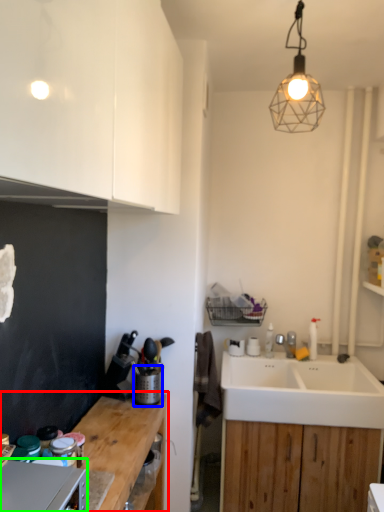
Question: Based on their relative distances, which object is nearer to countertop (highlighted by a red box)? Choose from appliance (highlighted by a blue box) and appliance (highlighted by a green box).

Choices:
 (A) appliance
 (B) appliance

Answer: (A)